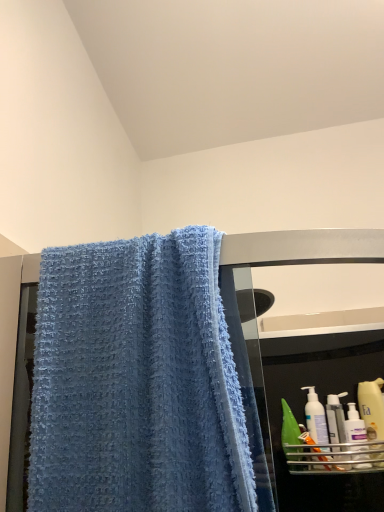
What are the coordinates of `white plastic bottle at right, placed as the first mouthwash when sorted from right to left` in the screenshot? It's located at (336, 418).

The image size is (384, 512). What do you see at coordinates (290, 434) in the screenshot?
I see `green matte bottle at right, which is the 2th mouthwash in right-to-left order` at bounding box center [290, 434].

From the picture: How much space does translucent plastic bottle at right, which is the 3th cleaning product in left-to-right order, occupy vertically?

translucent plastic bottle at right, which is the 3th cleaning product in left-to-right order, is 8.37 inches in height.

This screenshot has height=512, width=384. I want to click on white plastic bottle at right, arranged as the second mouthwash when viewed from the left, so click(336, 418).

Is translucent plastic bottle at right, which is the 3th cleaning product in left-to-right order, inside white plastic bottle at lower right, the second cleaning product when ordered from right to left?

No, translucent plastic bottle at right, which is the 3th cleaning product in left-to-right order, is located outside of white plastic bottle at lower right, the second cleaning product when ordered from right to left.

Based on the photo, how different are the orientations of white plastic bottle at lower right, marked as the second cleaning product in a left-to-right arrangement, and translucent plastic bottle at right, the 1th cleaning product when ordered from right to left, in degrees?

white plastic bottle at lower right, marked as the second cleaning product in a left-to-right arrangement, and translucent plastic bottle at right, the 1th cleaning product when ordered from right to left, are facing 0.00419 degrees away from each other.

Is white plastic bottle at lower right, marked as the second cleaning product in a left-to-right arrangement, to the right of translucent plastic bottle at right, which is the 3th cleaning product in left-to-right order, from the viewer's perspective?

No, white plastic bottle at lower right, marked as the second cleaning product in a left-to-right arrangement, is not to the right of translucent plastic bottle at right, which is the 3th cleaning product in left-to-right order.

In the image, is white plastic bottle at lower right, the second cleaning product when ordered from right to left, positioned in front of or behind translucent plastic bottle at right, the 1th cleaning product when ordered from right to left?

white plastic bottle at lower right, the second cleaning product when ordered from right to left, is positioned farther from the viewer than translucent plastic bottle at right, the 1th cleaning product when ordered from right to left.

From the image's perspective, which is below, white plastic bottle at lower right, marked as the second cleaning product in a left-to-right arrangement, or white plastic bottle at right, arranged as the second mouthwash when viewed from the left?

white plastic bottle at right, arranged as the second mouthwash when viewed from the left.

Does point (360, 432) appear closer or farther from the camera than point (329, 434)?

Clearly, point (360, 432) is closer to the camera than point (329, 434).

Considering the relative sizes of white plastic bottle at lower right, marked as the second cleaning product in a left-to-right arrangement, and white plastic bottle at right, arranged as the second mouthwash when viewed from the left, in the image provided, is white plastic bottle at lower right, marked as the second cleaning product in a left-to-right arrangement, thinner than white plastic bottle at right, arranged as the second mouthwash when viewed from the left,?

No.

Is white plastic bottle at right, placed as the first mouthwash when sorted from right to left, with translucent plastic bottle at right, the 1th cleaning product when ordered from right to left?

Absolutely, white plastic bottle at right, placed as the first mouthwash when sorted from right to left, is next to and touching translucent plastic bottle at right, the 1th cleaning product when ordered from right to left.

Is translucent plastic bottle at right, the 1th cleaning product when ordered from right to left, surrounded by white plastic bottle at right, arranged as the second mouthwash when viewed from the left?

Actually, translucent plastic bottle at right, the 1th cleaning product when ordered from right to left, is outside white plastic bottle at right, arranged as the second mouthwash when viewed from the left.

Is white plastic bottle at right, placed as the first mouthwash when sorted from right to left, wider or thinner than translucent plastic bottle at right, the 1th cleaning product when ordered from right to left?

Clearly, white plastic bottle at right, placed as the first mouthwash when sorted from right to left, has more width compared to translucent plastic bottle at right, the 1th cleaning product when ordered from right to left.

Is white plastic pump bottle at right, arranged as the third cleaning product when viewed from the right, to the left of translucent plastic bottle at right, the 1th cleaning product when ordered from right to left, from the viewer's perspective?

Correct, you'll find white plastic pump bottle at right, arranged as the third cleaning product when viewed from the right, to the left of translucent plastic bottle at right, the 1th cleaning product when ordered from right to left.

Does point (311, 396) come in front of point (372, 429)?

No, it is behind (372, 429).

How different are the orientations of white plastic pump bottle at right, acting as the 1th cleaning product starting from the left, and translucent plastic bottle at right, the 1th cleaning product when ordered from right to left, in degrees?

0.000411 degrees.

Can blue textured towel at upper left be found inside white plastic pump bottle at right, arranged as the third cleaning product when viewed from the right?

No, blue textured towel at upper left is not surrounded by white plastic pump bottle at right, arranged as the third cleaning product when viewed from the right.

In order to click on towel that is in front of the white plastic pump bottle at right, arranged as the third cleaning product when viewed from the right in this screenshot , I will do `click(137, 381)`.

From the picture: Which is behind, white plastic pump bottle at right, acting as the 1th cleaning product starting from the left, or blue textured towel at upper left?

white plastic pump bottle at right, acting as the 1th cleaning product starting from the left, is further away from the camera.

Is white plastic pump bottle at right, arranged as the third cleaning product when viewed from the right, taller than blue textured towel at upper left?

Incorrect, the height of white plastic pump bottle at right, arranged as the third cleaning product when viewed from the right, is not larger of that of blue textured towel at upper left.

In the image, is blue textured towel at upper left positioned in front of or behind white plastic pump bottle at right, arranged as the third cleaning product when viewed from the right?

In the image, blue textured towel at upper left appears in front of white plastic pump bottle at right, arranged as the third cleaning product when viewed from the right.

From a real-world perspective, who is located lower, blue textured towel at upper left or white plastic pump bottle at right, arranged as the third cleaning product when viewed from the right?

white plastic pump bottle at right, arranged as the third cleaning product when viewed from the right, from a real-world perspective.

Considering the points (108, 498) and (325, 438), which point is in front, point (108, 498) or point (325, 438)?

The point (108, 498) is closer.

Looking at their sizes, would you say blue textured towel at upper left is wider or thinner than white plastic pump bottle at right, arranged as the third cleaning product when viewed from the right?

Considering their sizes, blue textured towel at upper left looks broader than white plastic pump bottle at right, arranged as the third cleaning product when viewed from the right.

Is white plastic bottle at right, arranged as the second mouthwash when viewed from the left, directly adjacent to green matte bottle at right, the first mouthwash when ordered from left to right?

No, white plastic bottle at right, arranged as the second mouthwash when viewed from the left, is not making contact with green matte bottle at right, the first mouthwash when ordered from left to right.

Looking at this image, which object is further away from the camera taking this photo, white plastic bottle at right, placed as the first mouthwash when sorted from right to left, or green matte bottle at right, which is the 2th mouthwash in right-to-left order?

green matte bottle at right, which is the 2th mouthwash in right-to-left order.

Can green matte bottle at right, which is the 2th mouthwash in right-to-left order, be found inside white plastic bottle at right, arranged as the second mouthwash when viewed from the left?

No.

Is white plastic bottle at right, placed as the first mouthwash when sorted from right to left, oriented towards green matte bottle at right, the first mouthwash when ordered from left to right?

No, white plastic bottle at right, placed as the first mouthwash when sorted from right to left, is not oriented towards green matte bottle at right, the first mouthwash when ordered from left to right.

Locate an element on the screen. cleaning product in front of the white plastic bottle at lower right, marked as the second cleaning product in a left-to-right arrangement is located at coordinates (372, 408).

There is a white plastic bottle at right, placed as the first mouthwash when sorted from right to left. Where is `the 1st cleaning product above it (from a real-world perspective)`? the 1st cleaning product above it (from a real-world perspective) is located at coordinates (355, 426).

Estimate the real-world distances between objects in this image. Which object is closer to green matte bottle at right, which is the 2th mouthwash in right-to-left order, white plastic bottle at lower right, the second cleaning product when ordered from right to left, or blue textured towel at upper left?

white plastic bottle at lower right, the second cleaning product when ordered from right to left, is positioned closer to the anchor green matte bottle at right, which is the 2th mouthwash in right-to-left order.

In the scene shown: From the image, which object appears to be farther from white plastic pump bottle at right, acting as the 1th cleaning product starting from the left, white plastic bottle at lower right, the second cleaning product when ordered from right to left, or white plastic bottle at right, arranged as the second mouthwash when viewed from the left?

Based on the image, white plastic bottle at lower right, the second cleaning product when ordered from right to left, appears to be further to white plastic pump bottle at right, acting as the 1th cleaning product starting from the left.

Which object lies nearer to the anchor point white plastic bottle at right, arranged as the second mouthwash when viewed from the left, white plastic bottle at lower right, the second cleaning product when ordered from right to left, or translucent plastic bottle at right, which is the 3th cleaning product in left-to-right order?

white plastic bottle at lower right, the second cleaning product when ordered from right to left, lies closer to white plastic bottle at right, arranged as the second mouthwash when viewed from the left, than the other object.

Looking at the image, which one is located further to white plastic bottle at right, placed as the first mouthwash when sorted from right to left, white plastic bottle at lower right, marked as the second cleaning product in a left-to-right arrangement, or white plastic pump bottle at right, acting as the 1th cleaning product starting from the left?

The object further to white plastic bottle at right, placed as the first mouthwash when sorted from right to left, is white plastic pump bottle at right, acting as the 1th cleaning product starting from the left.

When comparing their distances from green matte bottle at right, the first mouthwash when ordered from left to right, does translucent plastic bottle at right, the 1th cleaning product when ordered from right to left, or blue textured towel at upper left seem closer?

Based on the image, translucent plastic bottle at right, the 1th cleaning product when ordered from right to left, appears to be nearer to green matte bottle at right, the first mouthwash when ordered from left to right.

From the image, which object appears to be farther from white plastic bottle at lower right, the second cleaning product when ordered from right to left, blue textured towel at upper left or white plastic pump bottle at right, acting as the 1th cleaning product starting from the left?

blue textured towel at upper left lies further to white plastic bottle at lower right, the second cleaning product when ordered from right to left, than the other object.

Based on the photo, looking at the image, which one is located closer to white plastic bottle at lower right, marked as the second cleaning product in a left-to-right arrangement, translucent plastic bottle at right, the 1th cleaning product when ordered from right to left, or white plastic pump bottle at right, arranged as the third cleaning product when viewed from the right?

Among the two, translucent plastic bottle at right, the 1th cleaning product when ordered from right to left, is located nearer to white plastic bottle at lower right, marked as the second cleaning product in a left-to-right arrangement.

Estimate the real-world distances between objects in this image. Which object is closer to green matte bottle at right, the first mouthwash when ordered from left to right, blue textured towel at upper left or white plastic bottle at right, placed as the first mouthwash when sorted from right to left?

white plastic bottle at right, placed as the first mouthwash when sorted from right to left, is closer to green matte bottle at right, the first mouthwash when ordered from left to right.

In order to click on mouthwash located between white plastic pump bottle at right, arranged as the third cleaning product when viewed from the right, and translucent plastic bottle at right, which is the 3th cleaning product in left-to-right order, in the left-right direction in this screenshot , I will do `click(336, 418)`.

Locate an element on the screen. The width and height of the screenshot is (384, 512). mouthwash between white plastic pump bottle at right, arranged as the third cleaning product when viewed from the right, and white plastic bottle at lower right, the second cleaning product when ordered from right to left, in the horizontal direction is located at coordinates (336, 418).

Image resolution: width=384 pixels, height=512 pixels. What are the coordinates of `cleaning product between blue textured towel at upper left and white plastic bottle at lower right, the second cleaning product when ordered from right to left, in the front-back direction` in the screenshot? It's located at (372, 408).

Find the location of a particular element. cleaning product situated between white plastic bottle at right, placed as the first mouthwash when sorted from right to left, and translucent plastic bottle at right, which is the 3th cleaning product in left-to-right order, from left to right is located at coordinates (355, 426).